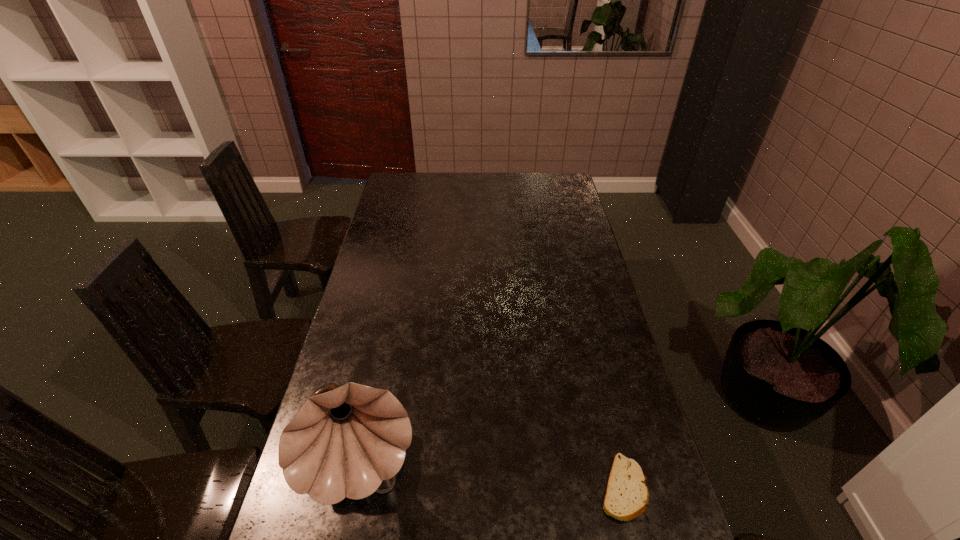
You are a GUI agent. You are given a task and a screenshot of the screen. Output one action in this format:
    pyautogui.click(x=<x>, y=<y>)
    Task: Click on the right object
    The image size is (960, 540).
    Given the screenshot: What is the action you would take?
    pyautogui.click(x=626, y=497)

Where is `pita bread`? This screenshot has width=960, height=540. pita bread is located at coordinates (626, 497).

This screenshot has width=960, height=540. In order to click on free space located on the left of the shorter object in this screenshot , I will do `click(451, 488)`.

Where is `object present at the right edge`? This screenshot has height=540, width=960. object present at the right edge is located at coordinates (626, 497).

In the image, there is a desktop. Identify the location of vacant space at the far edge. This screenshot has height=540, width=960. pyautogui.click(x=494, y=176).

Locate an element on the screen. Image resolution: width=960 pixels, height=540 pixels. free space at the left edge of the desktop is located at coordinates (410, 234).

In the image, there is a desktop. At what (x,y) coordinates should I click in order to perform the action: click on vacant area at the right edge. Please return your answer as a coordinate pair (x, y). Looking at the image, I should click on (584, 273).

Find the location of `free region at the far left corner`. free region at the far left corner is located at coordinates (401, 182).